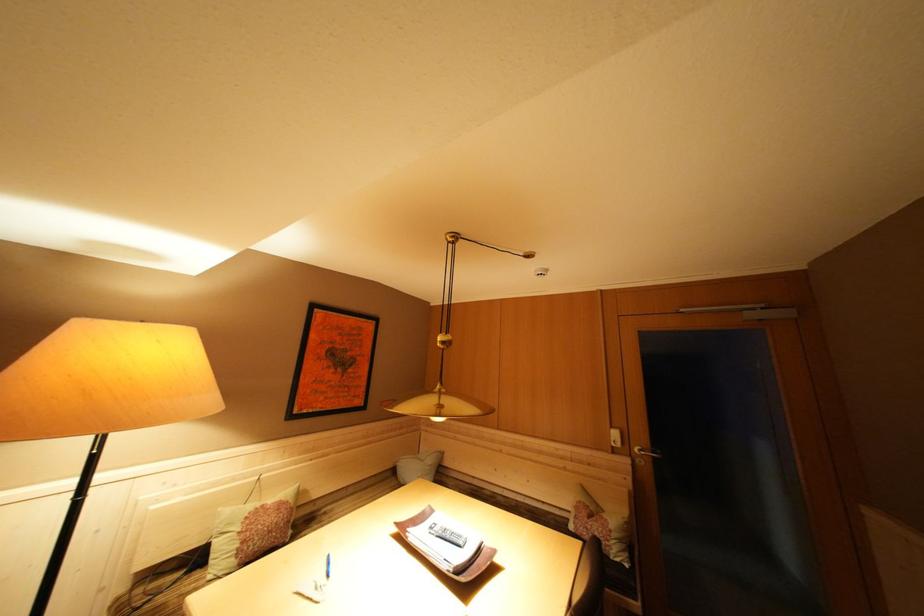
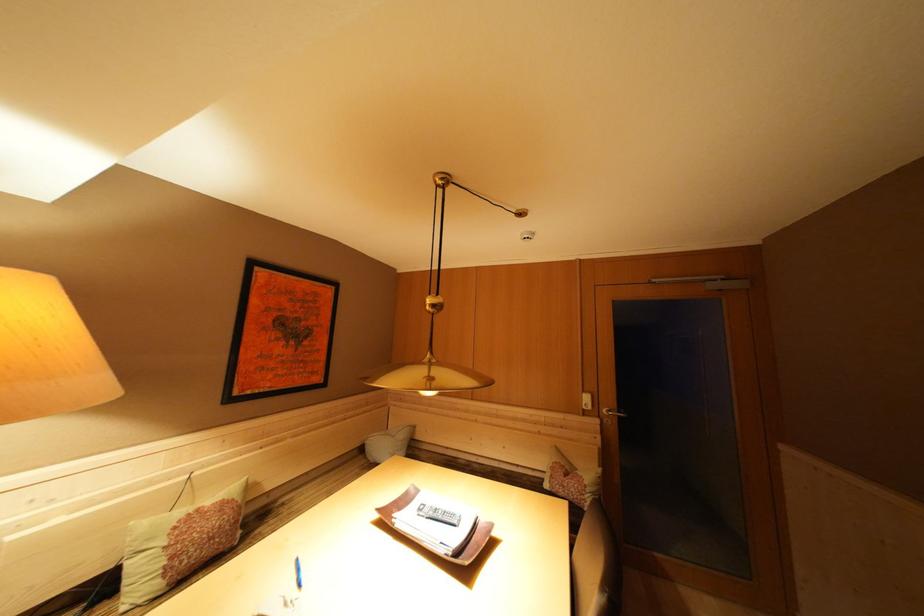
Locate, in the second image, the point that corresponds to point (446, 398) in the first image.

(438, 369)